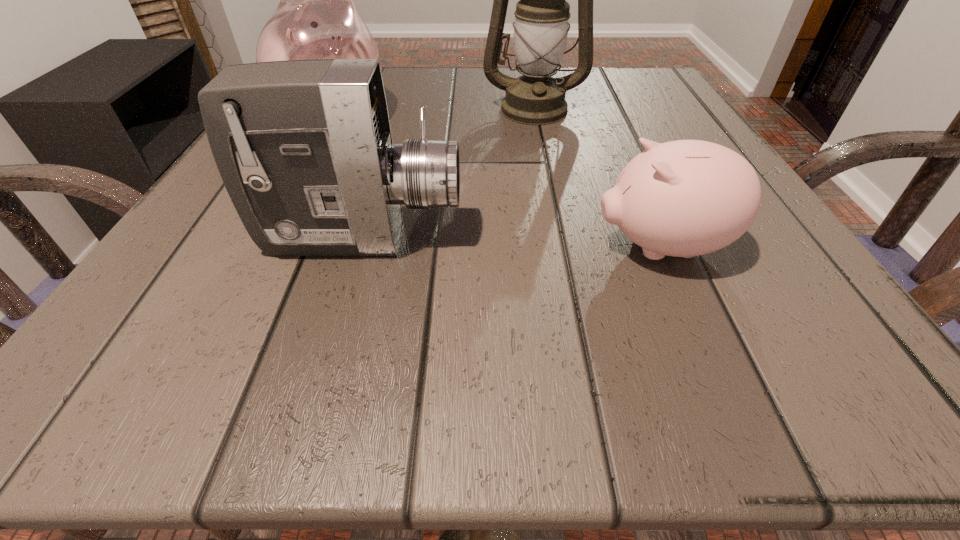
At what (x,y) coordinates should I click in order to perform the action: click on oil lamp. Please return your answer as a coordinate pair (x, y). The height and width of the screenshot is (540, 960). Looking at the image, I should click on (541, 29).

This screenshot has width=960, height=540. I want to click on camcorder, so [304, 148].

Find the location of a particular element. This screenshot has width=960, height=540. the left piggy bank is located at coordinates (316, 18).

This screenshot has width=960, height=540. Find the location of `the taller piggy bank`. the taller piggy bank is located at coordinates (316, 18).

This screenshot has height=540, width=960. I want to click on the nearer piggy bank, so click(684, 198).

Find the location of a particular element. Image resolution: width=960 pixels, height=540 pixels. the shorter piggy bank is located at coordinates (684, 198).

Find the location of `vacant space situated 0.330m on the front of the oil lamp`. vacant space situated 0.330m on the front of the oil lamp is located at coordinates (561, 247).

You are a GUI agent. You are given a task and a screenshot of the screen. Output one action in this format:
    pyautogui.click(x=<x>, y=<y>)
    Task: Click on the free space located 0.390m at the front of the camcorder, highlighting the lens
    The image size is (960, 540).
    Given the screenshot: What is the action you would take?
    pyautogui.click(x=764, y=238)

Where is `free space located 0.070m at the snout of the right piggy bank`? This screenshot has height=540, width=960. free space located 0.070m at the snout of the right piggy bank is located at coordinates pos(536,247).

Locate an element on the screen. This screenshot has height=540, width=960. free space located at the snout of the right piggy bank is located at coordinates (321, 247).